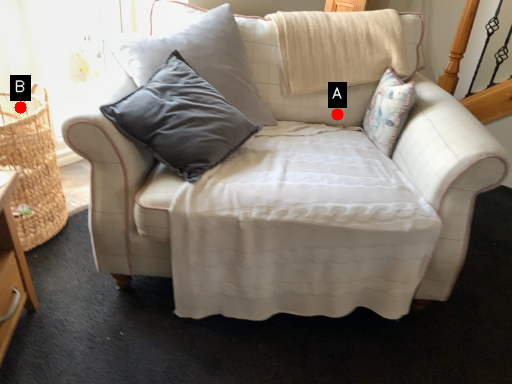
Question: Two points are circled on the image, labeled by A and B beside each circle. Which of the following is the closest to the observer?

Choices:
 (A) A is closer
 (B) B is closer

Answer: (B)